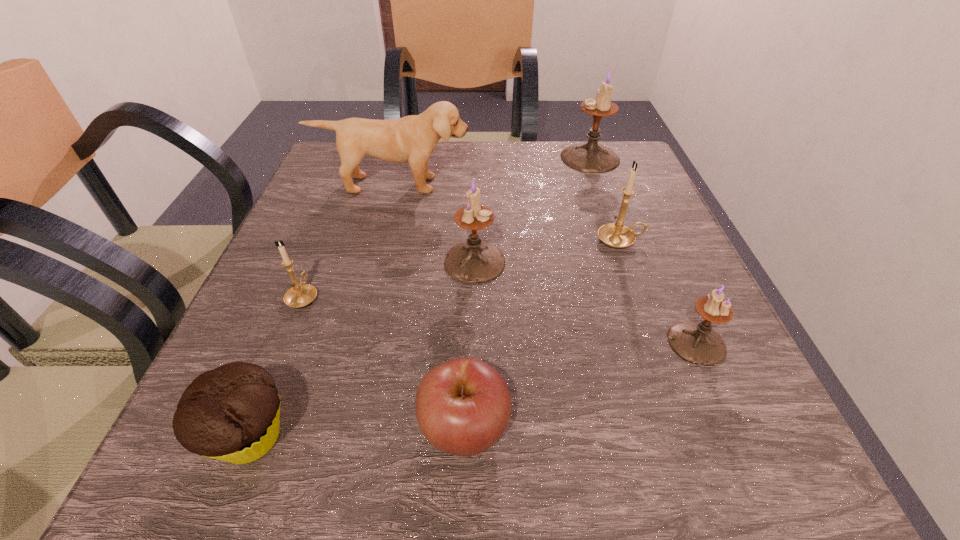
Identify the location of the sixth farthest object. The image size is (960, 540). (696, 342).

Identify the location of the smallest purple candle holder. (696, 342).

I want to click on muffin, so point(232,413).

Identify the location of apple. The image size is (960, 540). (463, 406).

This screenshot has height=540, width=960. Identify the location of vacant space located 0.080m on the front of the farthest object. (602, 193).

I want to click on blank space located on the left side of the puppy, so click(360, 315).

Locate an element on the screen. This screenshot has height=540, width=960. vacant position located on the right of the second candle holder from left to right is located at coordinates (583, 262).

Locate an element on the screen. vacant space situated on the handle side of the right gold candle holder is located at coordinates (675, 241).

Where is `blank area located 0.320m on the handle side of the leftmost candle holder`? This screenshot has height=540, width=960. blank area located 0.320m on the handle side of the leftmost candle holder is located at coordinates (348, 183).

You are a GUI agent. You are given a task and a screenshot of the screen. Output one action in this format:
    pyautogui.click(x=<x>, y=<y>)
    Task: Click on the blank space located 0.140m on the handle side of the leftmost candle holder
    The image size is (960, 540).
    Given the screenshot: What is the action you would take?
    pyautogui.click(x=328, y=232)